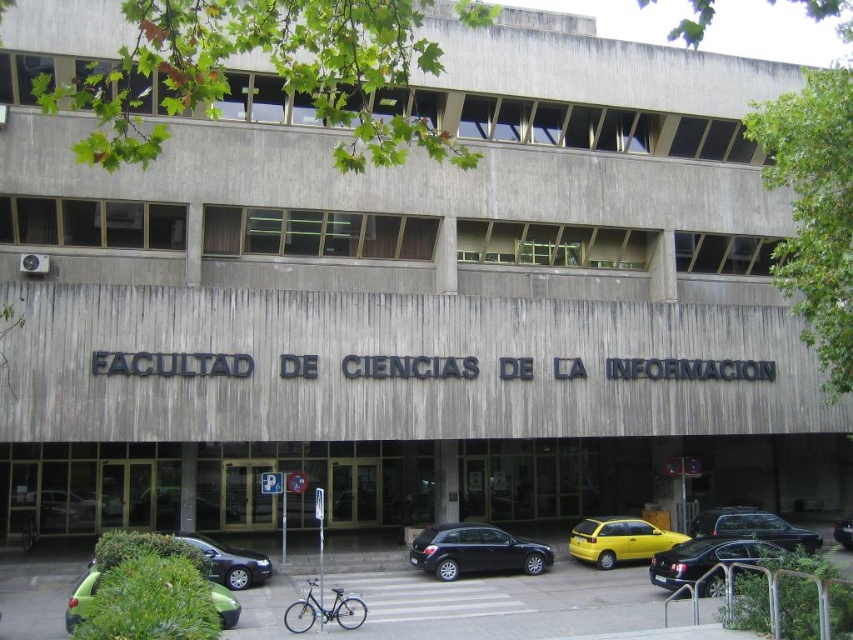
Question: Does green matte car at lower left appear under blue metallic bicycle at center?

Choices:
 (A) no
 (B) yes

Answer: (A)

Question: Which of the following is the farthest from the observer?

Choices:
 (A) [624, 557]
 (B) [287, 612]
 (C) [740, 532]
 (D) [834, 536]

Answer: (D)

Question: Does shiny black sedan at lower right appear over blue metallic bicycle at lower center?

Choices:
 (A) no
 (B) yes

Answer: (B)

Question: Which object is closer to the camera taking this photo?

Choices:
 (A) blue metallic bicycle at center
 (B) shiny black hatchback at center
 (C) yellow matte hatchback at center
 (D) green matte car at lower left

Answer: (D)

Question: Does shiny black hatchback at center appear over blue metallic bicycle at center?

Choices:
 (A) yes
 (B) no

Answer: (A)

Question: Considering the real-world distances, which object is closest to the green matte car at center?

Choices:
 (A) shiny black sedan at lower right
 (B) black glossy car at center
 (C) green matte car at lower left

Answer: (C)